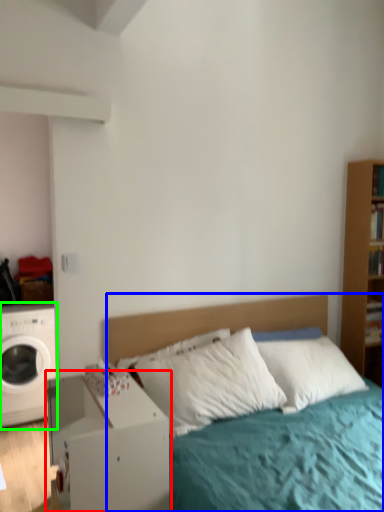
Question: Estimate the real-world distances between objects in this image. Which object is closer to nightstand (highlighted by a red box), bed (highlighted by a blue box) or washing machine (highlighted by a green box)?

Choices:
 (A) bed
 (B) washing machine

Answer: (A)